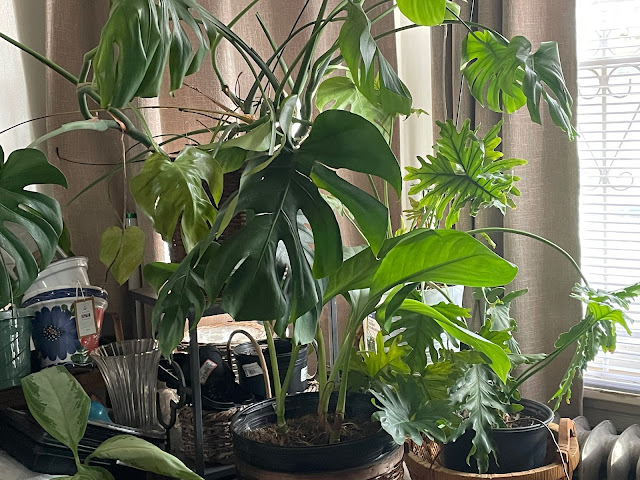
Identify the location of glass plant pots. (70, 325), (59, 295), (65, 275), (13, 336), (136, 390).